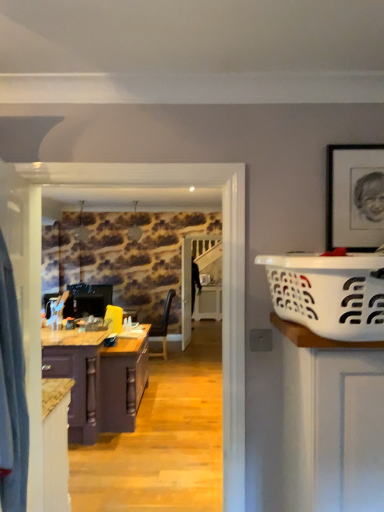
Question: From the image's perspective, is white plastic laundry basket at right above or below purple wood cabinet at left?

Choices:
 (A) below
 (B) above

Answer: (B)

Question: From a real-world perspective, relative to purple wood cabinet at left, is white plastic laundry basket at right vertically above or below?

Choices:
 (A) above
 (B) below

Answer: (A)

Question: Looking at the image, does white plastic laundry basket at right seem bigger or smaller compared to purple wood cabinet at left?

Choices:
 (A) big
 (B) small

Answer: (B)

Question: Considering the relative positions of purple wood cabinet at left and white plastic laundry basket at right in the image provided, is purple wood cabinet at left to the left or to the right of white plastic laundry basket at right?

Choices:
 (A) left
 (B) right

Answer: (A)

Question: Considering the positions of purple wood cabinet at left and white plastic laundry basket at right in the image, is purple wood cabinet at left bigger or smaller than white plastic laundry basket at right?

Choices:
 (A) small
 (B) big

Answer: (B)

Question: Would you say purple wood cabinet at left is inside or outside white plastic laundry basket at right?

Choices:
 (A) inside
 (B) outside

Answer: (B)

Question: Does point (107, 399) appear closer or farther from the camera than point (283, 297)?

Choices:
 (A) closer
 (B) farther

Answer: (B)